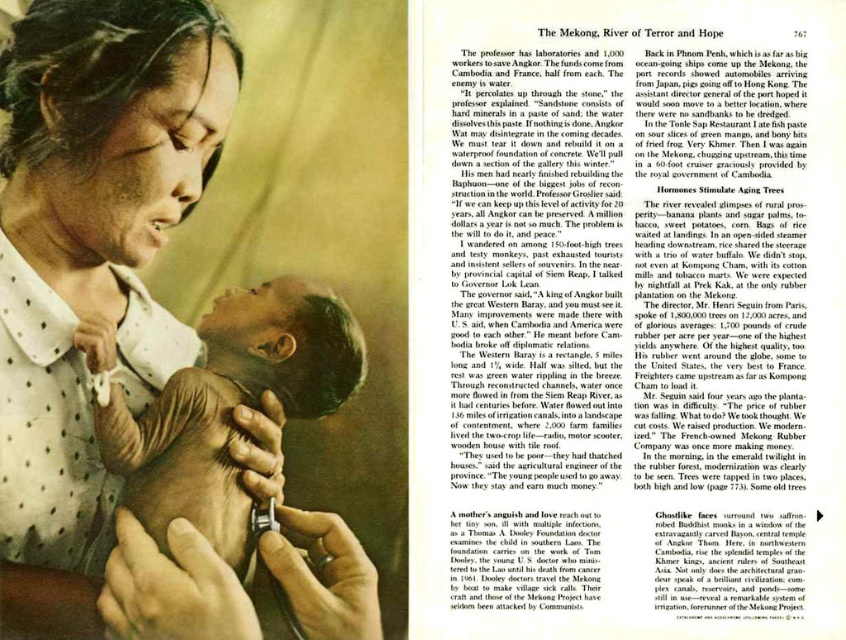
In the image, you see a woman wearing a matte white blouse at center holding a light brown skin baby at center. Which object is taller?

The matte white blouse at center is taller than the light brown skin baby at center.

Based on the scene description, where is the matte white blouse at center positioned in relation to the baby?

The matte white blouse at center is located at point (89,260), which places it near the upper middle part of the image. Since the baby is being held in the woman arms, the blouse is positioned above the baby.

You are designing a layout for a magazine article. The image provided has a matte white blouse at center and a light brown skin baby at center. To ensure proper focus on the baby, which object should you adjust in size and why?

The matte white blouse at center is bigger than the light brown skin baby at center. To focus on the baby, you should reduce the size of the matte white blouse at center so it doesn not overshadow the baby.